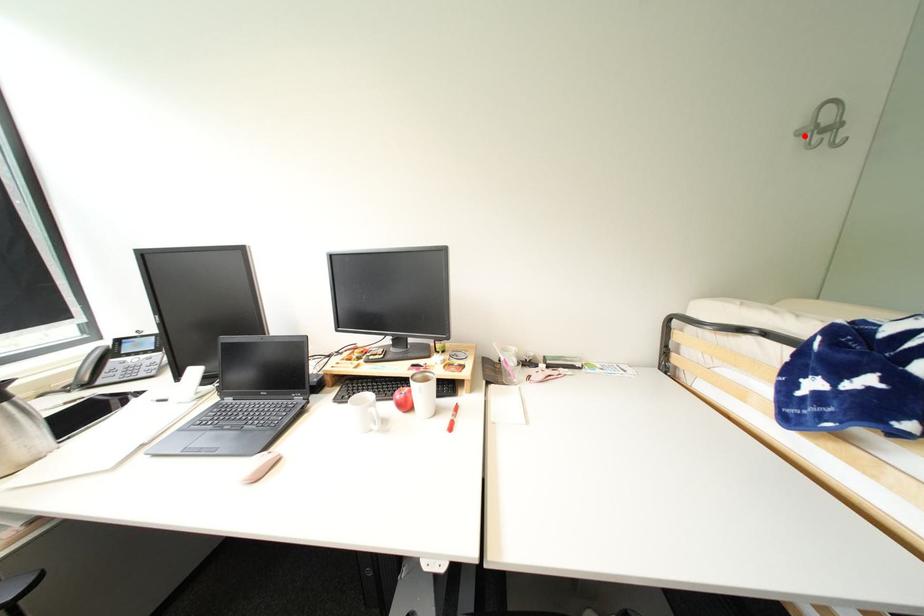
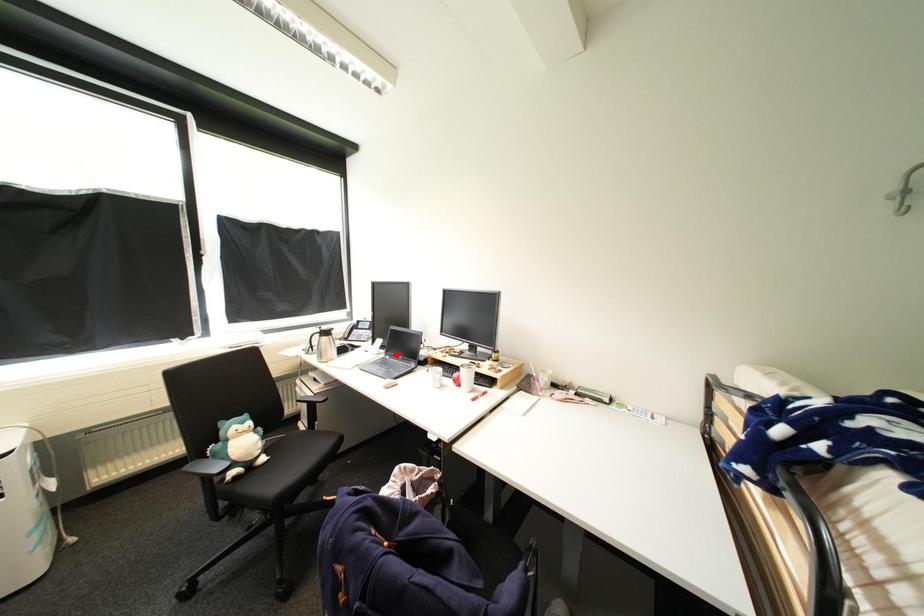
I am providing you with two images of the same scene from different viewpoints. A red point is marked on the first image and another point is marked on the second image. Does the point marked in image1 correspond to the same location as the one in image2?

No